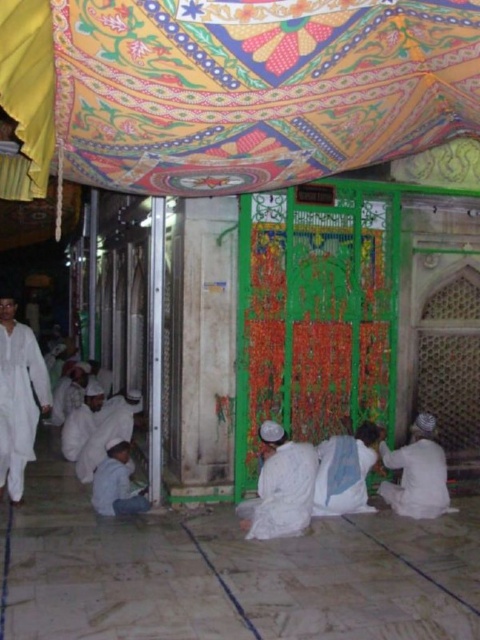
Question: Which of the following is the closest to the observer?

Choices:
 (A) (276, 522)
 (B) (421, 460)
 (C) (139, 500)

Answer: (A)

Question: Estimate the real-world distances between objects in this image. Which object is closer to the white cotton robe at left?

Choices:
 (A) white cotton robe at center
 (B) white matte robe at lower left
 (C) white matte robe at lower center

Answer: (B)

Question: Can you confirm if white cotton robe at left is smaller than white matte robe at lower center?

Choices:
 (A) yes
 (B) no

Answer: (B)

Question: Does white matte robe at lower right have a larger size compared to white matte robe at lower left?

Choices:
 (A) no
 (B) yes

Answer: (B)

Question: Can you confirm if white matte robe at lower center is positioned to the right of white matte robe at lower left?

Choices:
 (A) yes
 (B) no

Answer: (A)

Question: Estimate the real-world distances between objects in this image. Which object is closer to the white matte robe at lower right?

Choices:
 (A) white matte robe at lower center
 (B) white cotton robe at left
 (C) white matte robe at lower left

Answer: (A)